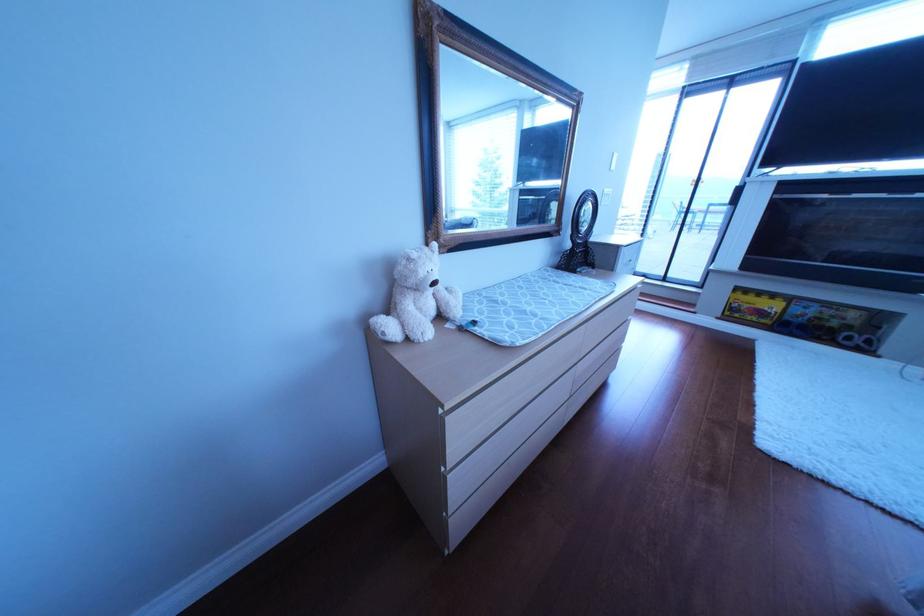
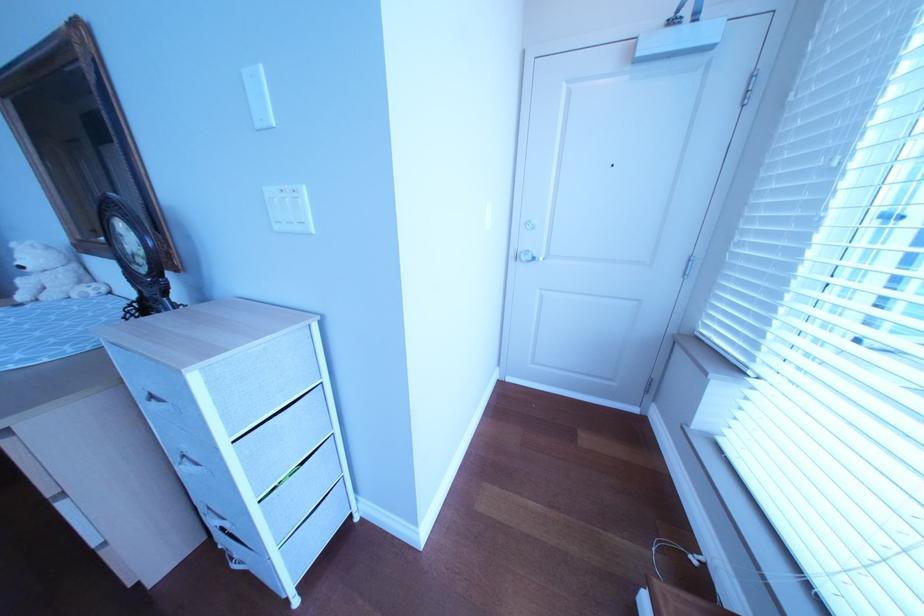
Find the pixel in the second image that matches [617,206] in the first image.

(292, 229)